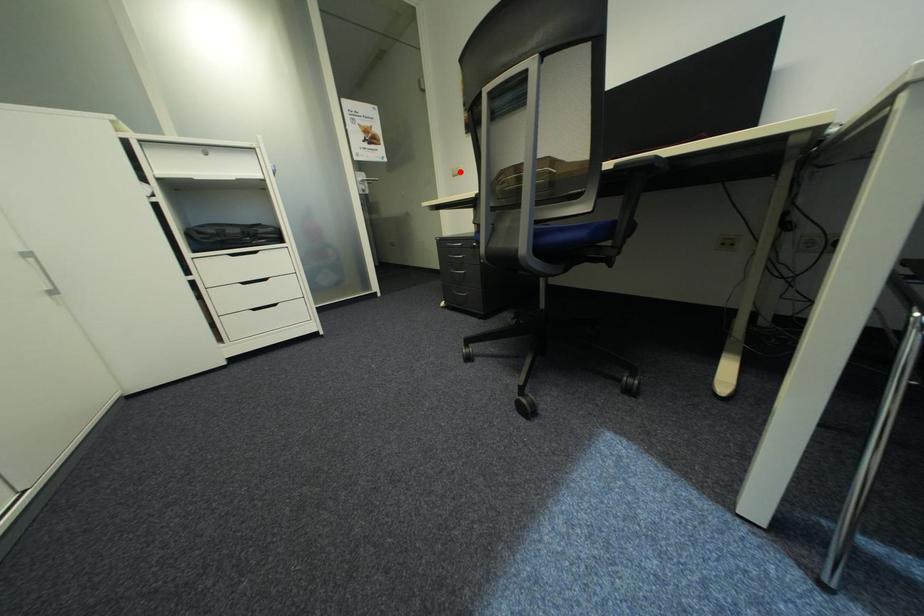
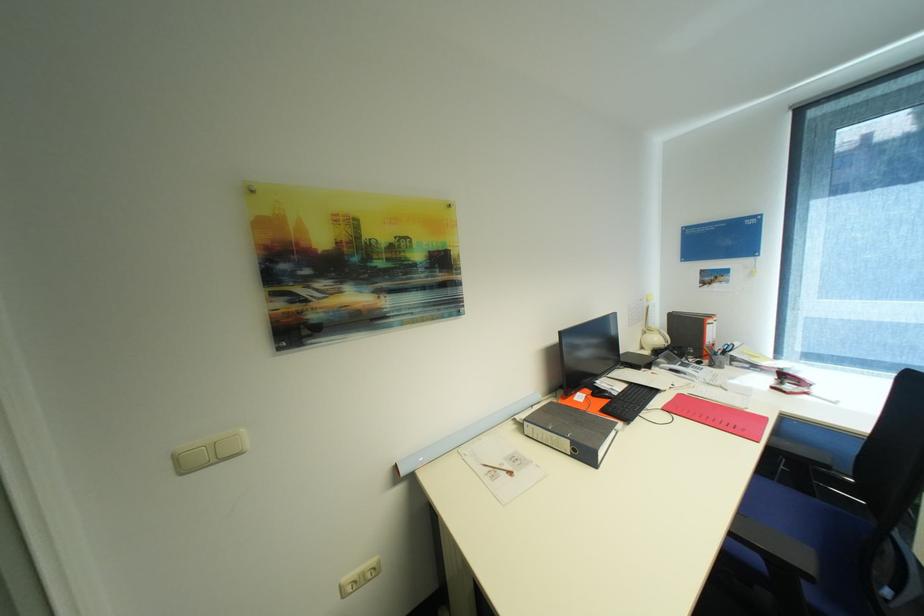
The point at the highlighted location is marked in the first image. Where is the corresponding point in the second image?

(185, 458)